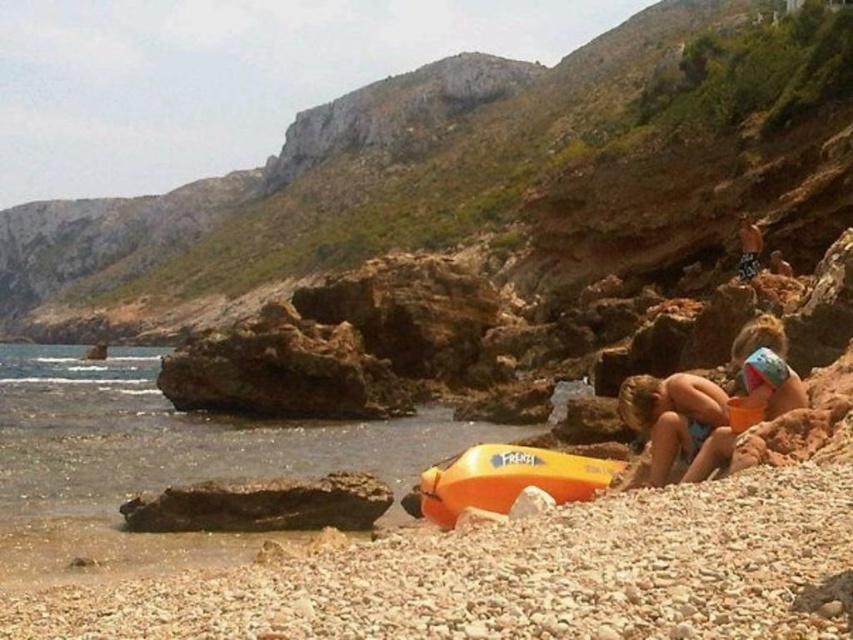
Question: Which point is farther to the camera?

Choices:
 (A) (653, 474)
 (B) (28, 234)

Answer: (B)

Question: Based on their relative distances, which object is nearer to the blue fabric shorts at lower right?

Choices:
 (A) smooth brown rock at upper right
 (B) matte yellow float at right

Answer: (B)

Question: Can you confirm if blue fabric shorts at lower right is thinner than smooth brown rock at upper right?

Choices:
 (A) yes
 (B) no

Answer: (A)

Question: Estimate the real-world distances between objects in this image. Which object is closer to the rough stone hillside at upper center?

Choices:
 (A) smooth brown rock at upper right
 (B) blue fabric shorts at lower right
 (C) matte yellow float at right

Answer: (A)

Question: Is blue fabric shorts at lower right to the left of matte yellow float at right from the viewer's perspective?

Choices:
 (A) yes
 (B) no

Answer: (A)

Question: Can you confirm if rough stone hillside at upper center is smaller than matte yellow float at right?

Choices:
 (A) yes
 (B) no

Answer: (B)